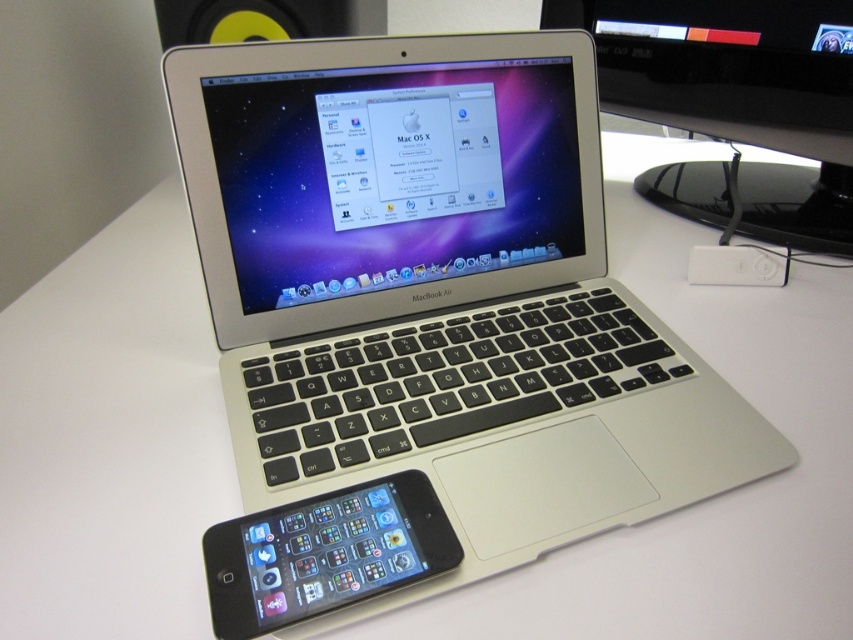
Question: Does silver/black keyboard at center appear on the left side of white plastic ipod at center?

Choices:
 (A) yes
 (B) no

Answer: (A)

Question: Which point appears farthest from the camera in this image?

Choices:
 (A) (201, 8)
 (B) (734, 256)

Answer: (A)

Question: Which object is farther from the camera taking this photo?

Choices:
 (A) silver/black keyboard at center
 (B) glossy black monitor at upper right
 (C) white plastic ipod at center

Answer: (B)

Question: Is glossy black monitor at upper right in front of black glossy iphone at lower left?

Choices:
 (A) no
 (B) yes

Answer: (A)

Question: Does black glossy iphone at lower left lie in front of yellow plastic speaker at upper left?

Choices:
 (A) no
 (B) yes

Answer: (B)

Question: Which object appears farthest from the camera in this image?

Choices:
 (A) white plastic ipod at center
 (B) yellow plastic speaker at upper left

Answer: (B)